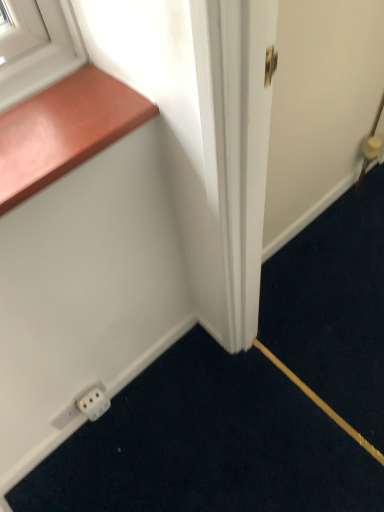
Question: Considering the positions of white plastic electric outlet at lower left, the second electric outlet when ordered from right to left, and white plastic outlet at lower left, the first electric outlet when ordered from right to left, in the image, is white plastic electric outlet at lower left, the second electric outlet when ordered from right to left, taller or shorter than white plastic outlet at lower left, the first electric outlet when ordered from right to left,?

Choices:
 (A) tall
 (B) short

Answer: (B)

Question: Considering their positions, is white plastic electric outlet at lower left, the second electric outlet when ordered from right to left, located in front of or behind white plastic outlet at lower left, the second electric outlet positioned from the left?

Choices:
 (A) front
 (B) behind

Answer: (B)

Question: Which object is positioned closest to the white plastic electric outlet at lower left, acting as the first electric outlet starting from the left?

Choices:
 (A) white plastic outlet at lower left, the second electric outlet positioned from the left
 (B) wooden at upper left

Answer: (A)

Question: Estimate the real-world distances between objects in this image. Which object is closer to the white plastic electric outlet at lower left, the second electric outlet when ordered from right to left?

Choices:
 (A) wooden at upper left
 (B) white plastic outlet at lower left, the first electric outlet when ordered from right to left

Answer: (B)